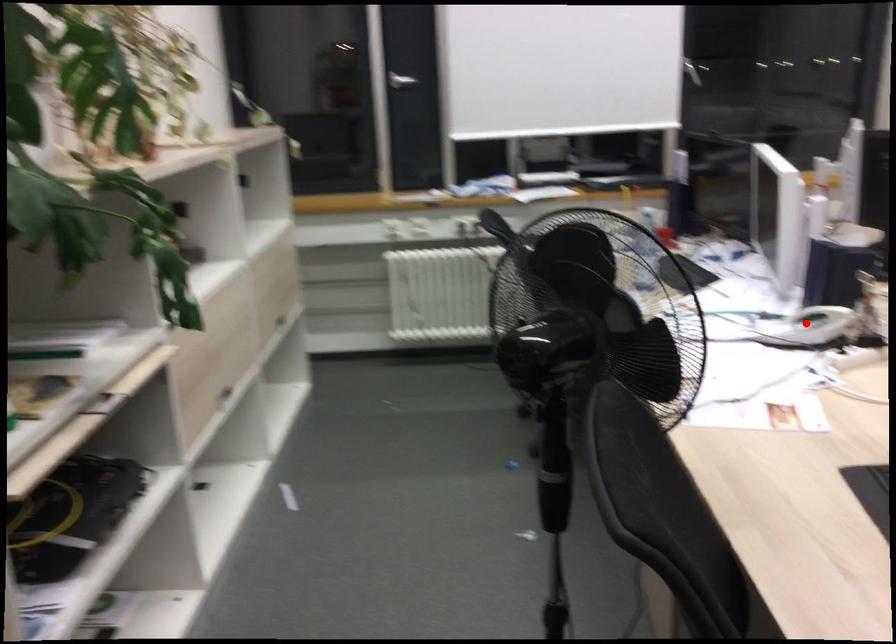
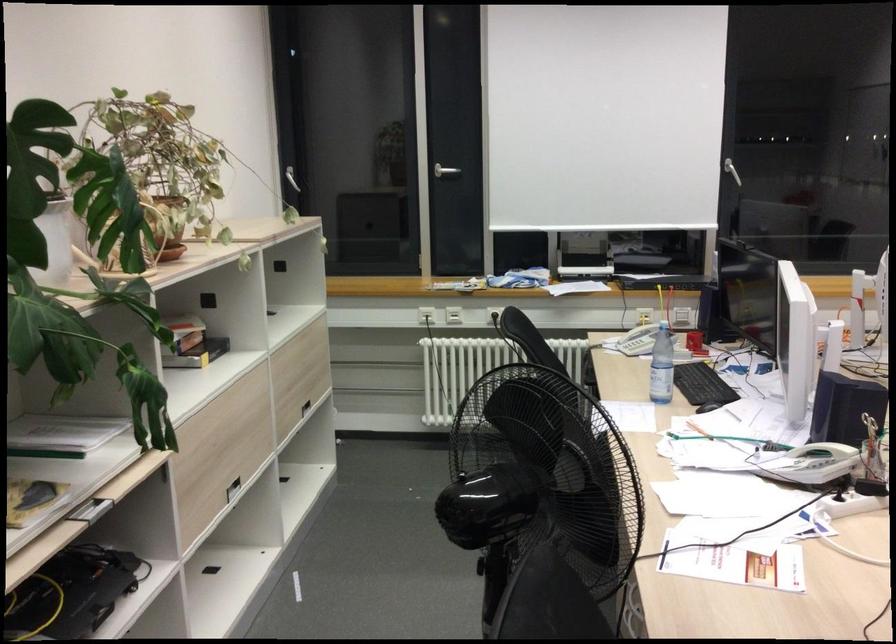
In the second image, find the point that corresponds to the highlighted location in the first image.

(814, 464)